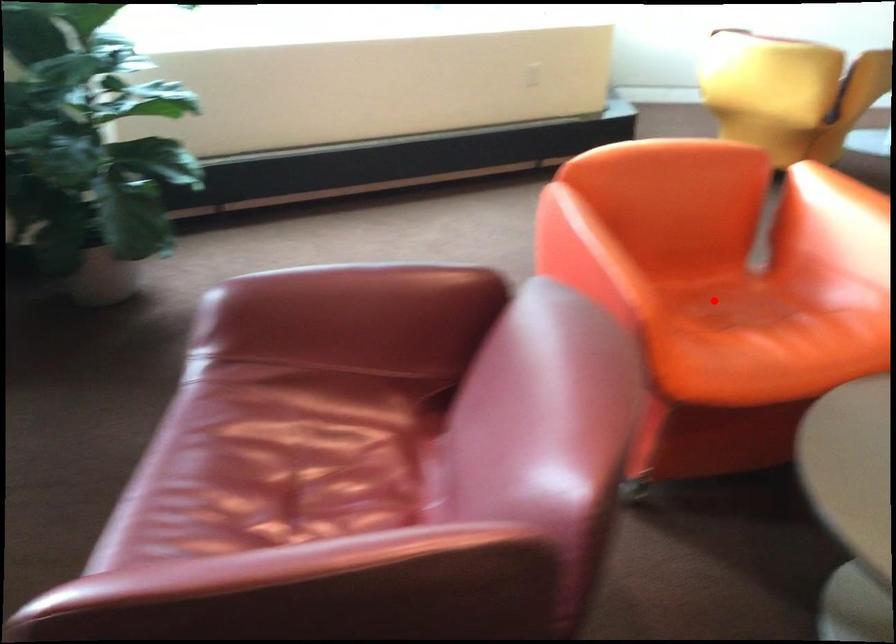
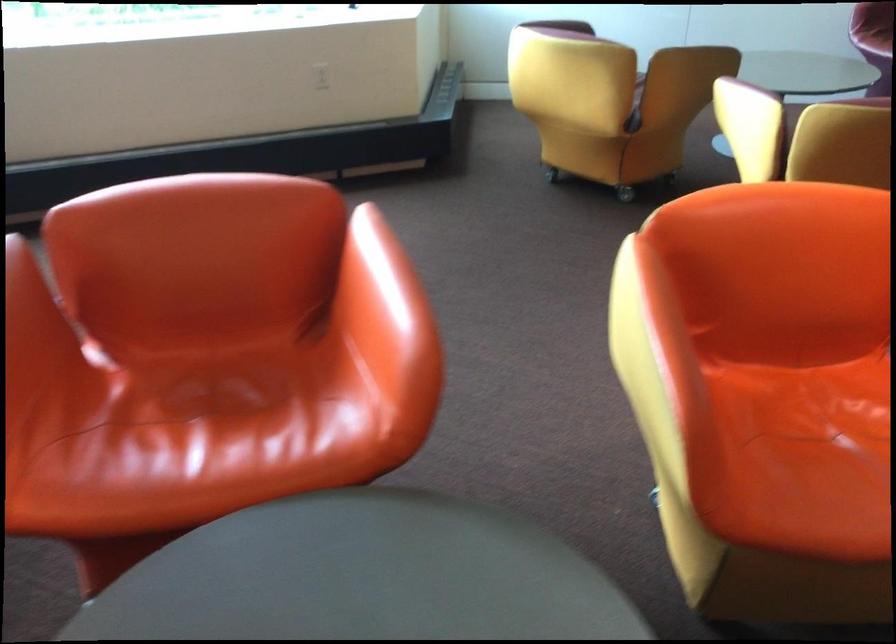
Locate, in the second image, the point that corresponds to the highlighted location in the first image.

(208, 384)